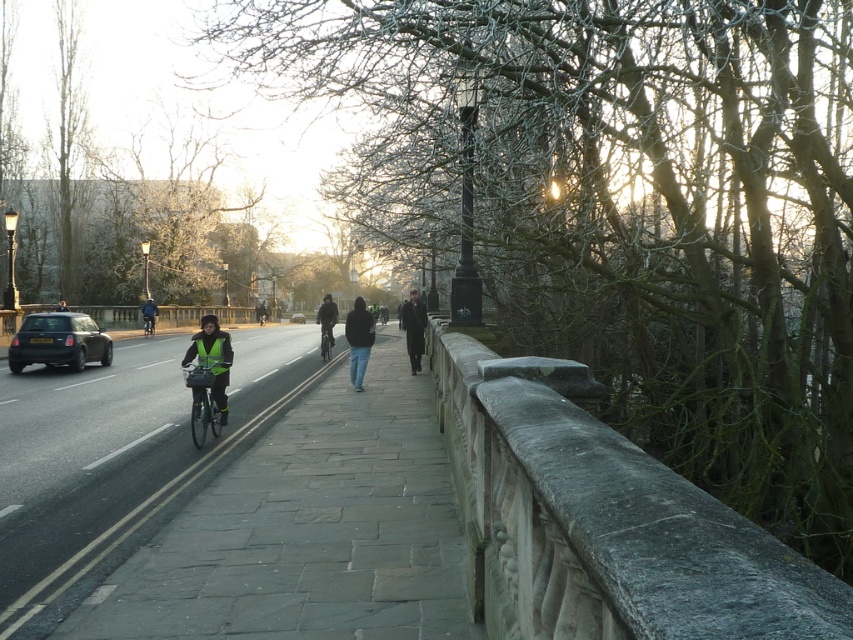
You are standing on the bridge and see two points marked on the road. Which point is closer to you, the point at coordinate (213, 392) or the point at (328, 358)?

The point at coordinate (213, 392) is in front of the point at (328, 358), so it is closer to you.

You are standing at the center of the bridge and see the point marked at coordinates (57, 340). What object is located at that point?

The point at coordinates (57, 340) corresponds to the shiny black car at left.

You are standing at the camera position and want to cross the road to reach the shiny black car at left. Is the distance between you and the car sufficient to safely cross the road without getting hit by any vehicles?

The distance between the shiny black car at left and the camera is 66.97 feet. This distance is likely sufficient to safely cross the road, provided you do so carefully and ensure no other vehicles are approaching.